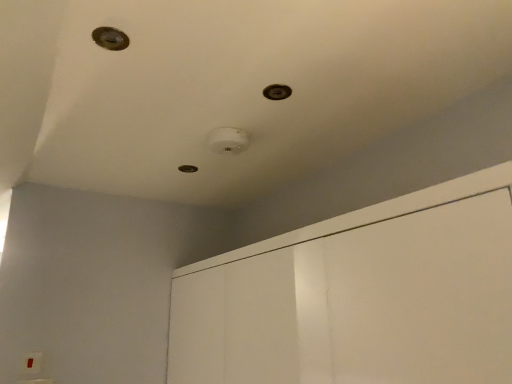
At what (x,y) coordinates should I click in order to perform the action: click on metallic circular hole at upper left, which is the first hole in top-to-bottom order. Please return your answer as a coordinate pair (x, y). The height and width of the screenshot is (384, 512). Looking at the image, I should click on (110, 38).

The width and height of the screenshot is (512, 384). What do you see at coordinates (110, 38) in the screenshot?
I see `metallic circular hole at upper left, marked as the 3th hole in a right-to-left arrangement` at bounding box center [110, 38].

Describe the element at coordinates (188, 169) in the screenshot. I see `metallic circular hole at center, placed as the 1th hole when sorted from back to front` at that location.

Find the location of a particular element. The width and height of the screenshot is (512, 384). metallic circular hole at upper center, which is the second hole from top to bottom is located at coordinates (277, 92).

Are metallic circular hole at upper center, the third hole positioned from the left, and metallic circular hole at center, which ranks as the 2th hole in left-to-right order, beside each other?

They are not placed beside each other.

Is point (280, 94) more distant than point (181, 171)?

No, (280, 94) is in front of (181, 171).

In terms of size, does metallic circular hole at upper center, the third hole positioned from the left, appear bigger or smaller than metallic circular hole at center, placed as the 1th hole when sorted from back to front?

Considering their sizes, metallic circular hole at upper center, the third hole positioned from the left, takes up less space than metallic circular hole at center, placed as the 1th hole when sorted from back to front.

Can you confirm if white glossy dresser at upper center is wider than metallic circular hole at upper left, the first hole in the left-to-right sequence?

Correct, the width of white glossy dresser at upper center exceeds that of metallic circular hole at upper left, the first hole in the left-to-right sequence.

From the white glossy dresser at upper center, count 1st holes backward and point to it. Please provide its 2D coordinates.

[(110, 38)]

Is white glossy dresser at upper center touching metallic circular hole at upper left, the third hole positioned from the bottom?

No, white glossy dresser at upper center is not beside metallic circular hole at upper left, the third hole positioned from the bottom.

Which is closer, (387, 309) or (122, 48)?

Point (387, 309).

Which point is more distant from viewer, [95,37] or [368,314]?

Point [368,314]

Could you tell me if metallic circular hole at upper left, which is the third hole in back-to-front order, is turned towards white glossy dresser at upper center?

No, metallic circular hole at upper left, which is the third hole in back-to-front order, is not oriented towards white glossy dresser at upper center.

Which object is closer to the camera, metallic circular hole at upper left, which is the third hole in back-to-front order, or white glossy dresser at upper center?

white glossy dresser at upper center is closer to the camera.

From the image's perspective, is metallic circular hole at upper left, marked as the 3th hole in a right-to-left arrangement, on white glossy dresser at upper center?

Indeed, from the image's perspective, metallic circular hole at upper left, marked as the 3th hole in a right-to-left arrangement, is shown above white glossy dresser at upper center.

Is white glossy dresser at upper center at the right side of metallic circular hole at upper center, which is the second hole from top to bottom?

Indeed, white glossy dresser at upper center is positioned on the right side of metallic circular hole at upper center, which is the second hole from top to bottom.

What are the coordinates of `dresser below the metallic circular hole at upper center, the third hole positioned from the left (from the image's perspective)` in the screenshot? It's located at (358, 305).

From the image's perspective, is white glossy dresser at upper center on top of metallic circular hole at upper center, the second hole from the bottom?

No, from the image's perspective, white glossy dresser at upper center is not over metallic circular hole at upper center, the second hole from the bottom.

Is white glossy dresser at upper center directly adjacent to metallic circular hole at upper center, which is the 2th hole in front-to-back order?

No, white glossy dresser at upper center is not with metallic circular hole at upper center, which is the 2th hole in front-to-back order.

In the scene shown: From a real-world perspective, which is physically below, metallic circular hole at upper center, the second hole positioned from the back, or metallic circular hole at upper left, marked as the 3th hole in a right-to-left arrangement?

metallic circular hole at upper left, marked as the 3th hole in a right-to-left arrangement, is physically lower.

Does metallic circular hole at upper center, the third hole positioned from the left, come behind metallic circular hole at upper left, the third hole positioned from the bottom?

That is True.

Considering the sizes of metallic circular hole at upper center, the third hole positioned from the left, and metallic circular hole at upper left, which is the first hole in top-to-bottom order, in the image, is metallic circular hole at upper center, the third hole positioned from the left, bigger or smaller than metallic circular hole at upper left, which is the first hole in top-to-bottom order,?

Considering their sizes, metallic circular hole at upper center, the third hole positioned from the left, takes up less space than metallic circular hole at upper left, which is the first hole in top-to-bottom order.

Would you say metallic circular hole at center, the third hole from the top, is outside white glossy dresser at upper center?

Indeed, metallic circular hole at center, the third hole from the top, is completely outside white glossy dresser at upper center.

Does metallic circular hole at center, which is the third hole in front-to-back order, turn towards white glossy dresser at upper center?

No, metallic circular hole at center, which is the third hole in front-to-back order, is not turned towards white glossy dresser at upper center.

Is the position of metallic circular hole at center, placed as the 1th hole when sorted from back to front, more distant than that of white glossy dresser at upper center?

Yes, the depth of metallic circular hole at center, placed as the 1th hole when sorted from back to front, is greater than that of white glossy dresser at upper center.

Is white glossy dresser at upper center placed right next to metallic circular hole at center, which ranks as the 2th hole in left-to-right order?

white glossy dresser at upper center is not next to metallic circular hole at center, which ranks as the 2th hole in left-to-right order, and they're not touching.

Is point (505, 373) positioned after point (191, 165)?

No, it is in front of (191, 165).

Is white glossy dresser at upper center aimed at metallic circular hole at center, which ranks as the 2th hole in left-to-right order?

Answer: No, white glossy dresser at upper center is not aimed at metallic circular hole at center, which ranks as the 2th hole in left-to-right order.

From the image's perspective, is white glossy dresser at upper center located beneath metallic circular hole at center, the first hole ordered from the bottom?

Indeed, from the image's perspective, white glossy dresser at upper center is shown beneath metallic circular hole at center, the first hole ordered from the bottom.

You are a GUI agent. You are given a task and a screenshot of the screen. Output one action in this format:
    pyautogui.click(x=<x>, y=<y>)
    Task: Click on the 1st hole in front of the metallic circular hole at center, which is the third hole in front-to-back order
    
    Given the screenshot: What is the action you would take?
    pyautogui.click(x=277, y=92)

The width and height of the screenshot is (512, 384). Identify the location of the 1st hole directly above the white glossy dresser at upper center (from a real-world perspective). (110, 38).

From the image, which object appears to be farther from metallic circular hole at center, placed as the 1th hole when sorted from back to front, white glossy dresser at upper center or metallic circular hole at upper left, marked as the 3th hole in a right-to-left arrangement?

white glossy dresser at upper center.

Which object lies nearer to the anchor point white glossy dresser at upper center, metallic circular hole at upper left, marked as the 3th hole in a right-to-left arrangement, or metallic circular hole at upper center, the second hole from the bottom?

metallic circular hole at upper center, the second hole from the bottom, is closer to white glossy dresser at upper center.

From the image, which object appears to be nearer to metallic circular hole at center, which ranks as the 2th hole in left-to-right order, metallic circular hole at upper left, which is the third hole in back-to-front order, or metallic circular hole at upper center, which is the second hole from top to bottom?

Among the two, metallic circular hole at upper center, which is the second hole from top to bottom, is located nearer to metallic circular hole at center, which ranks as the 2th hole in left-to-right order.

Considering their positions, is metallic circular hole at upper center, which is the 2th hole in front-to-back order, positioned closer to white glossy dresser at upper center than metallic circular hole at center, placed as the 1th hole when sorted from back to front?

metallic circular hole at upper center, which is the 2th hole in front-to-back order, is closer to white glossy dresser at upper center.

Estimate the real-world distances between objects in this image. Which object is further from metallic circular hole at upper left, which is the first hole in top-to-bottom order, white glossy dresser at upper center or metallic circular hole at center, the 2th hole positioned from the right?

white glossy dresser at upper center is further to metallic circular hole at upper left, which is the first hole in top-to-bottom order.

Looking at this image, which object lies nearer to the anchor point metallic circular hole at upper center, the second hole from the bottom, metallic circular hole at upper left, the first hole from the front, or white glossy dresser at upper center?

Among the two, metallic circular hole at upper left, the first hole from the front, is located nearer to metallic circular hole at upper center, the second hole from the bottom.

Which object lies further to the anchor point metallic circular hole at upper left, marked as the 3th hole in a right-to-left arrangement, metallic circular hole at center, the first hole ordered from the bottom, or metallic circular hole at upper center, which appears as the first hole when viewed from the right?

metallic circular hole at center, the first hole ordered from the bottom, lies further to metallic circular hole at upper left, marked as the 3th hole in a right-to-left arrangement, than the other object.

Which object lies further to the anchor point white glossy dresser at upper center, metallic circular hole at center, which is the third hole in front-to-back order, or metallic circular hole at upper center, which is the second hole from top to bottom?

metallic circular hole at center, which is the third hole in front-to-back order, lies further to white glossy dresser at upper center than the other object.

Locate an element on the screen. The width and height of the screenshot is (512, 384). hole located between metallic circular hole at upper left, the first hole in the left-to-right sequence, and metallic circular hole at center, the 2th hole positioned from the right, in the depth direction is located at coordinates (277, 92).